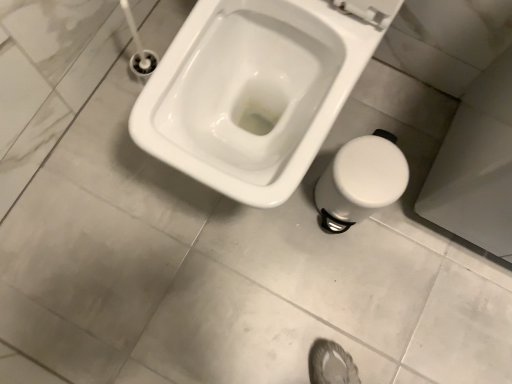
You are a GUI agent. You are given a task and a screenshot of the screen. Output one action in this format:
    pyautogui.click(x=<x>, y=<y>)
    Task: Click on the unoccupied area behind white plastic bidet at lower right
    This screenshot has height=384, width=512.
    Given the screenshot: What is the action you would take?
    pyautogui.click(x=367, y=127)